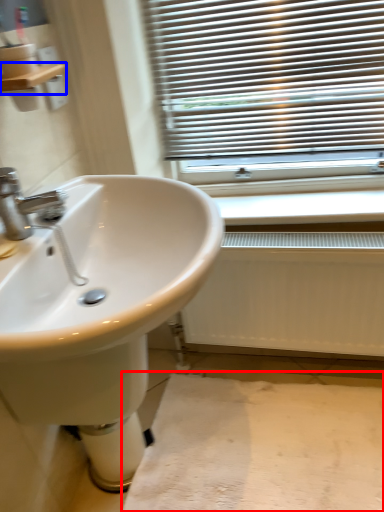
Question: Which object is closer to the camera taking this photo, plain (highlighted by a red box) or balustrade (highlighted by a blue box)?

Choices:
 (A) plain
 (B) balustrade

Answer: (B)